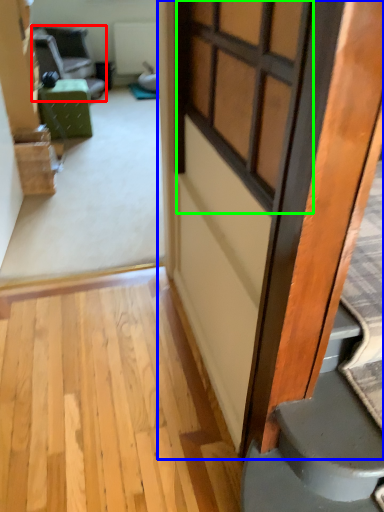
Question: Based on their relative distances, which object is farther from chair (highlighted by a red box)? Choose from door (highlighted by a blue box) and window (highlighted by a green box).

Choices:
 (A) door
 (B) window

Answer: (A)